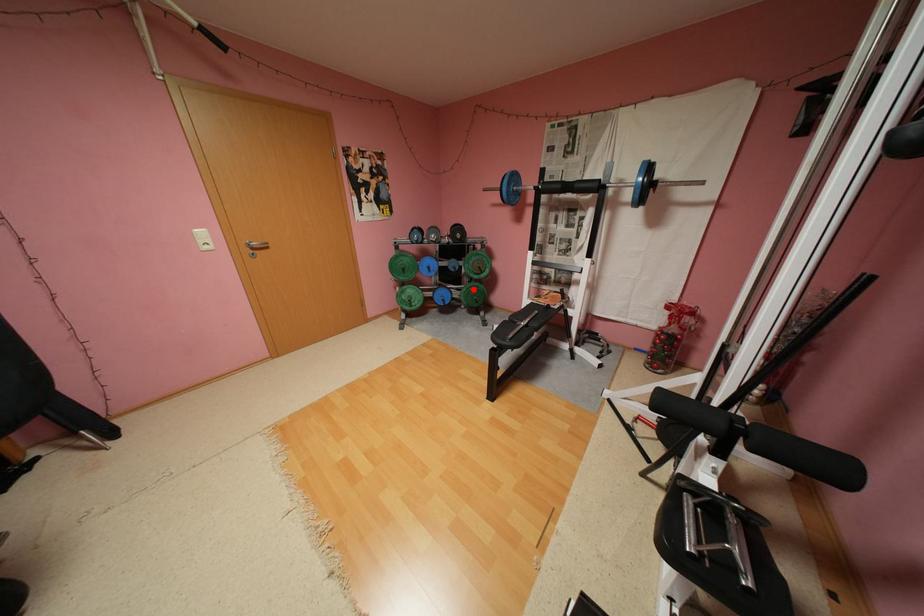
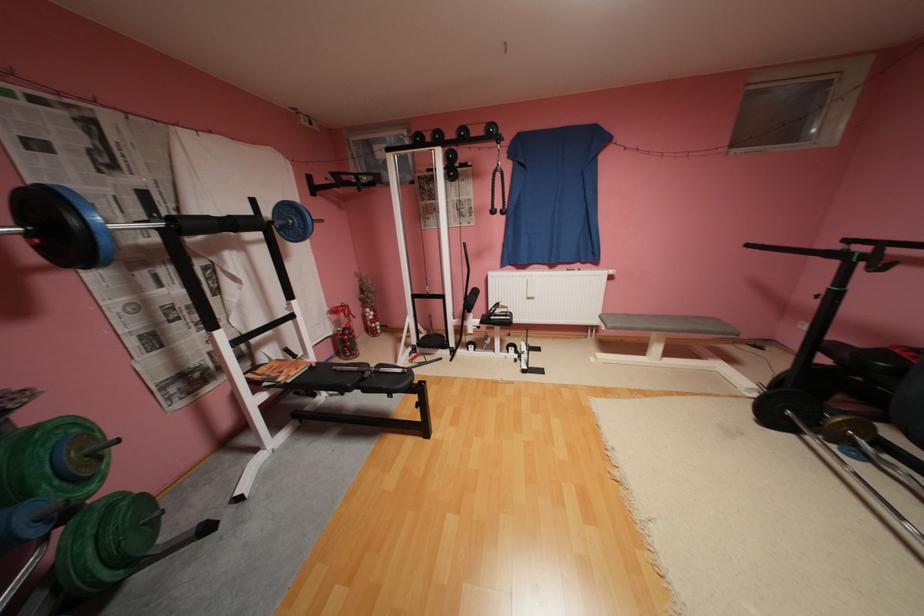
Locate, in the second image, the point that corresponds to the highlighted location in the first image.

(100, 551)